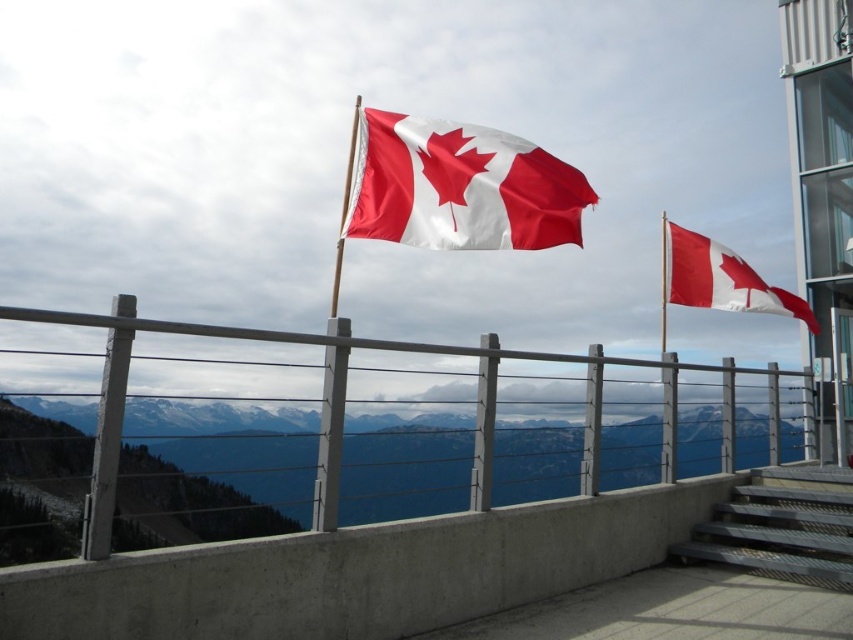
Does red/white fabric flag at upper right appear on the left side of smooth white flag pole at center?

In fact, red/white fabric flag at upper right is to the right of smooth white flag pole at center.

The width and height of the screenshot is (853, 640). Describe the element at coordinates (718, 280) in the screenshot. I see `red/white fabric flag at upper right` at that location.

Locate an element on the screen. The width and height of the screenshot is (853, 640). red/white fabric flag at upper right is located at coordinates [718, 280].

Who is taller, matte fabric canadian flag at center or red/white fabric flag at upper right?

A: With more height is red/white fabric flag at upper right.

Does matte fabric canadian flag at center appear on the right side of red/white fabric flag at upper right?

No, matte fabric canadian flag at center is not to the right of red/white fabric flag at upper right.

Between point (454, 211) and point (689, 259), which one is positioned in front?

Point (454, 211)

Find the location of `matte fabric canadian flag at center`. matte fabric canadian flag at center is located at coordinates (460, 188).

Between metallic gray stairs at lower right and smooth white flag pole at center, which one has more height?

With more height is smooth white flag pole at center.

In the scene shown: Between metallic gray stairs at lower right and smooth white flag pole at center, which one appears on the left side from the viewer's perspective?

From the viewer's perspective, smooth white flag pole at center appears more on the left side.

Find the location of `metallic gray stairs at lower right`. metallic gray stairs at lower right is located at coordinates (782, 525).